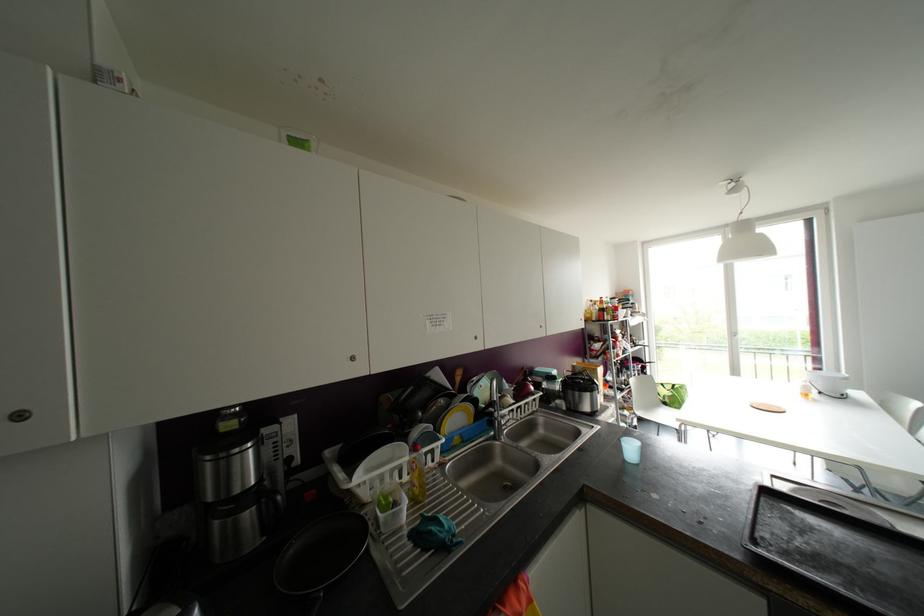
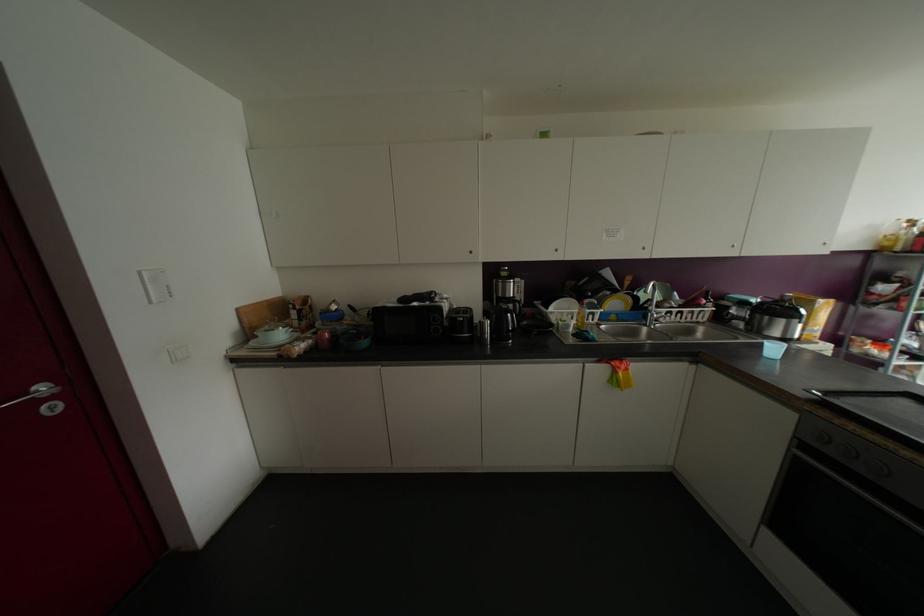
The point at (476, 338) is marked in the first image. Where is the corresponding point in the second image?

(642, 248)